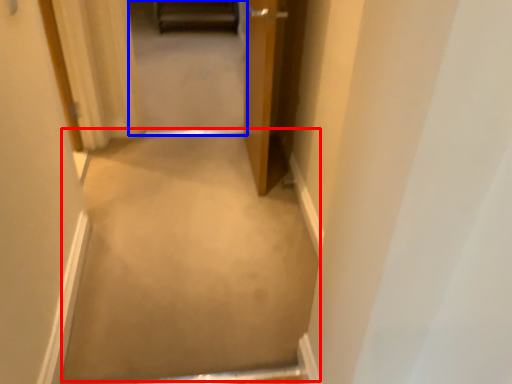
Question: Which of the following is the farthest to the observer, plain (highlighted by a red box) or passage (highlighted by a blue box)?

Choices:
 (A) plain
 (B) passage

Answer: (B)